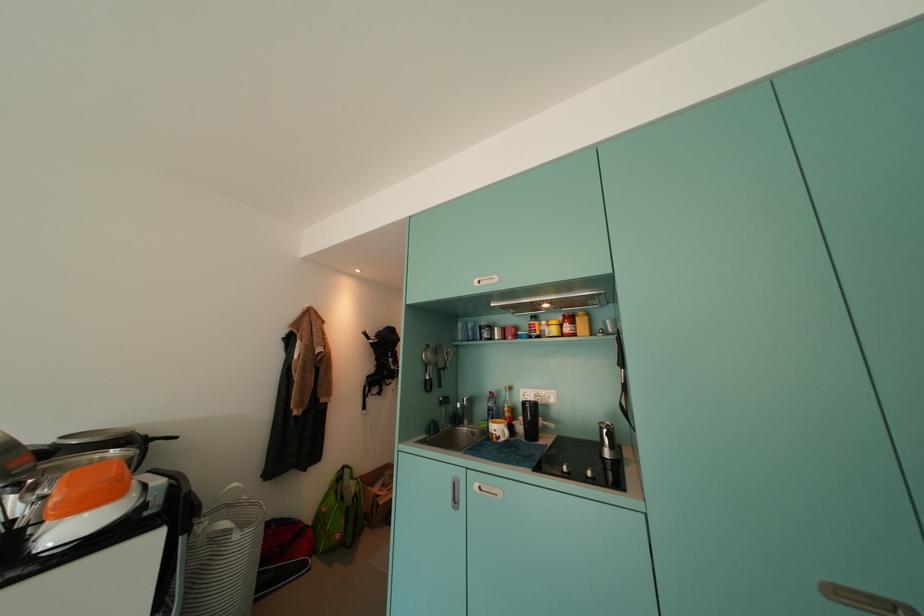
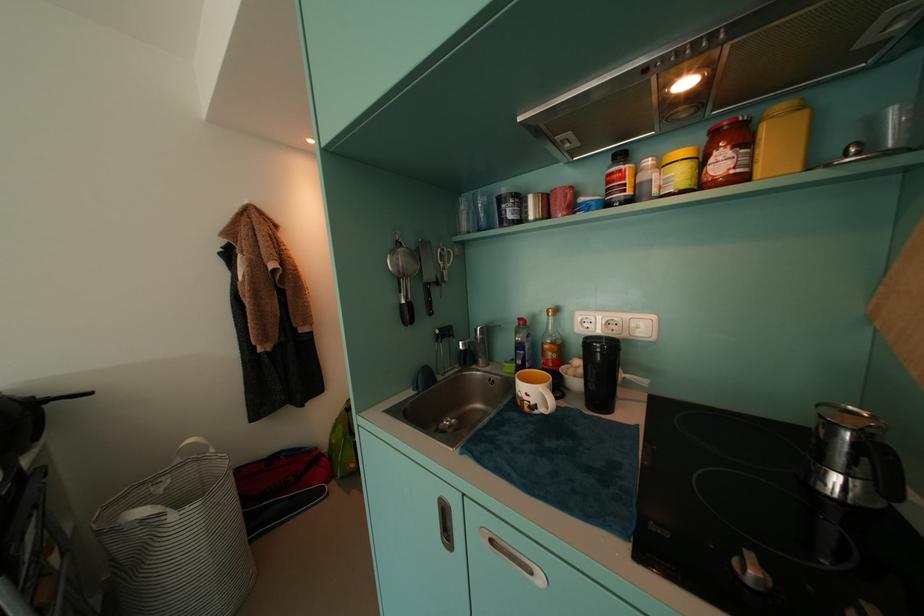
In the second image, find the point that corresponds to pixel 626 467 in the first image.

(891, 525)